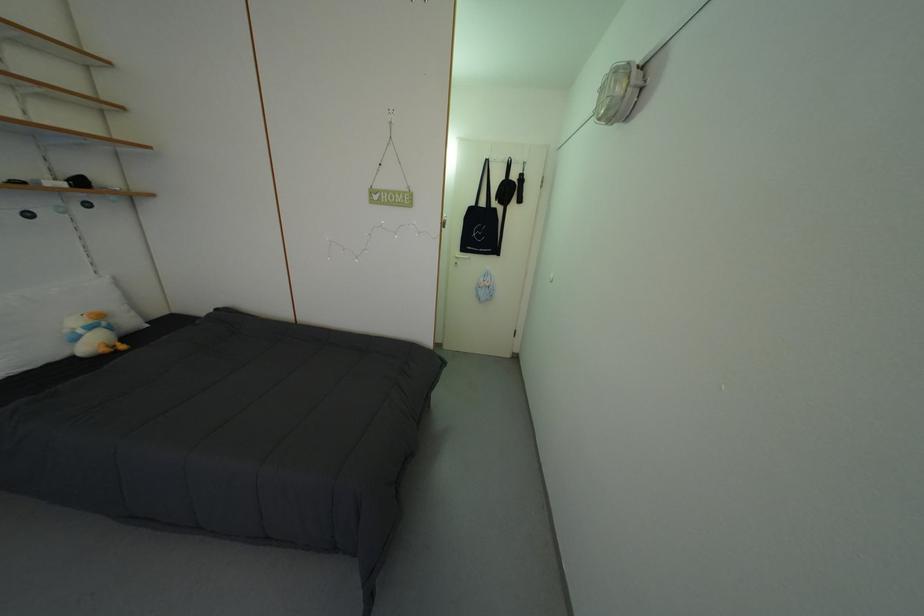
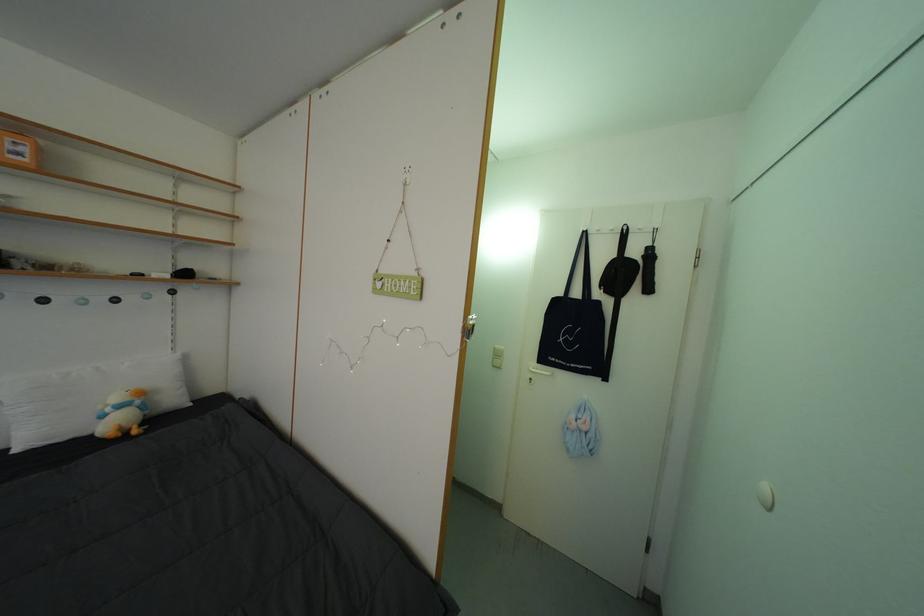
Where in the second image is the point corresponding to (492,209) from the first image?

(586, 300)